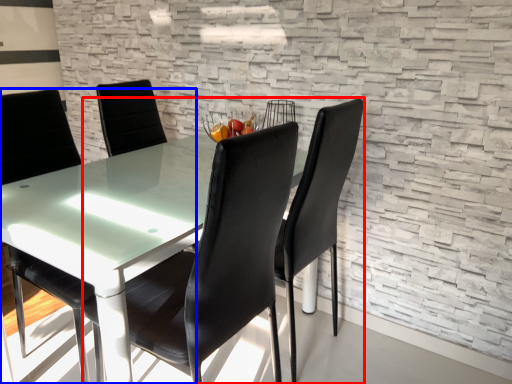
Question: Which object is closer to the camera taking this photo, chair (highlighted by a red box) or chair (highlighted by a blue box)?

Choices:
 (A) chair
 (B) chair

Answer: (A)